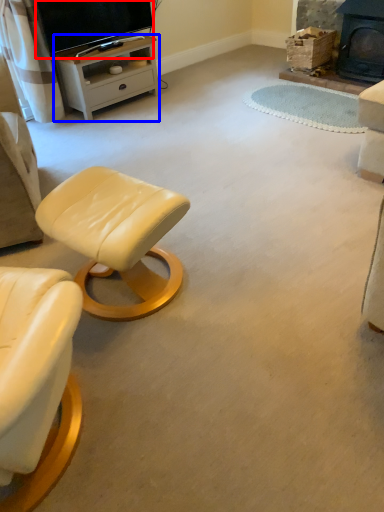
Question: Which of the following is the farthest to the observer, television (highlighted by a red box) or desk (highlighted by a blue box)?

Choices:
 (A) television
 (B) desk

Answer: (B)